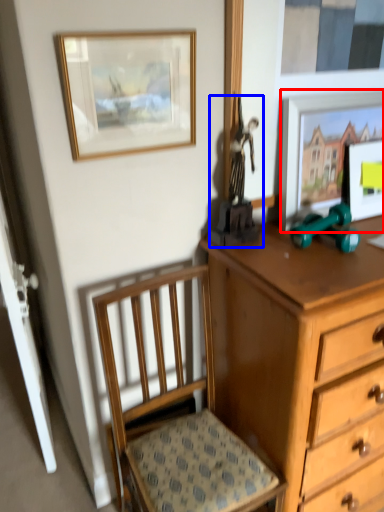
Question: Which point is further to the camera, picture frame (highlighted by a red box) or toy (highlighted by a blue box)?

Choices:
 (A) picture frame
 (B) toy

Answer: (A)